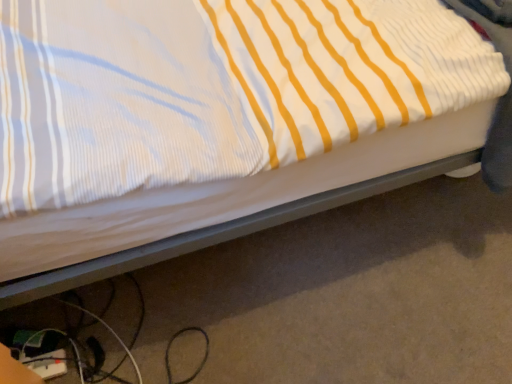
What do you see at coordinates (46, 363) in the screenshot? This screenshot has height=384, width=512. I see `white plastic extension cord at lower left` at bounding box center [46, 363].

Where is `white plastic extension cord at lower left`? This screenshot has height=384, width=512. white plastic extension cord at lower left is located at coordinates (46, 363).

I want to click on white plastic extension cord at lower left, so point(46,363).